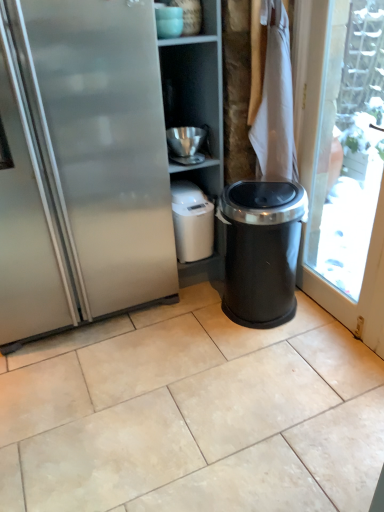
Identify the location of free space in front of black plastic trash can at right. (269, 367).